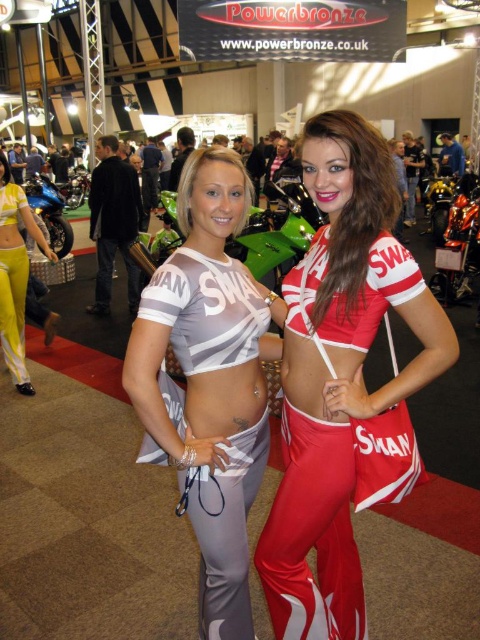
Question: In this image, where is matte gray fabric top at center located relative to shiny metallic motorcycle at center right?

Choices:
 (A) left
 (B) right

Answer: (A)

Question: Which point is farther to the camera?

Choices:
 (A) (447, 180)
 (B) (235, 532)
 (C) (379, 170)
 (D) (20, 211)

Answer: (A)

Question: Which object is positioned closest to the matte red fabric outfit at center?

Choices:
 (A) shiny blue motorcycle at left
 (B) yellow fabric top at left

Answer: (B)

Question: From the image, what is the correct spatial relationship of yellow fabric top at left in relation to shiny blue motorcycle at left?

Choices:
 (A) right
 (B) left

Answer: (A)

Question: Which object appears closest to the camera in this image?

Choices:
 (A) matte gray fabric top at center
 (B) shiny blue motorcycle at left

Answer: (A)

Question: Can you confirm if matte gray fabric top at center is positioned to the right of shiny metallic motorcycle at center right?

Choices:
 (A) yes
 (B) no

Answer: (B)